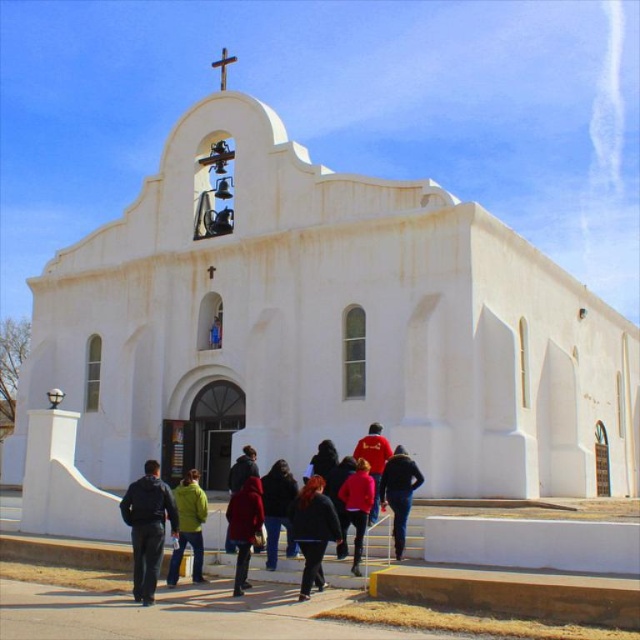
Does black leather jacket at center have a larger size compared to matte red jacket at center?

Actually, black leather jacket at center might be smaller than matte red jacket at center.

This screenshot has width=640, height=640. What do you see at coordinates (312, 531) in the screenshot? I see `black leather jacket at center` at bounding box center [312, 531].

What do you see at coordinates (312, 531) in the screenshot? The width and height of the screenshot is (640, 640). I see `black leather jacket at center` at bounding box center [312, 531].

Image resolution: width=640 pixels, height=640 pixels. I want to click on black leather jacket at center, so click(x=312, y=531).

Does matte red coat at center have a lesser height compared to matte red jacket at center?

Yes.

Is matte red coat at center to the right of matte red jacket at center from the viewer's perspective?

No, matte red coat at center is not to the right of matte red jacket at center.

This screenshot has height=640, width=640. Describe the element at coordinates (244, 525) in the screenshot. I see `matte red coat at center` at that location.

Find the location of `matte red coat at center`. matte red coat at center is located at coordinates (244, 525).

Is dark blue jeans at center to the left of red cotton shirt at center from the viewer's perspective?

In fact, dark blue jeans at center is to the right of red cotton shirt at center.

Can you confirm if dark blue jeans at center is shorter than red cotton shirt at center?

Indeed, dark blue jeans at center has a lesser height compared to red cotton shirt at center.

Measure the distance between point (392, 490) and camera.

Point (392, 490) and camera are 148.07 feet apart.

The image size is (640, 640). I want to click on dark blue jeans at center, so tap(397, 492).